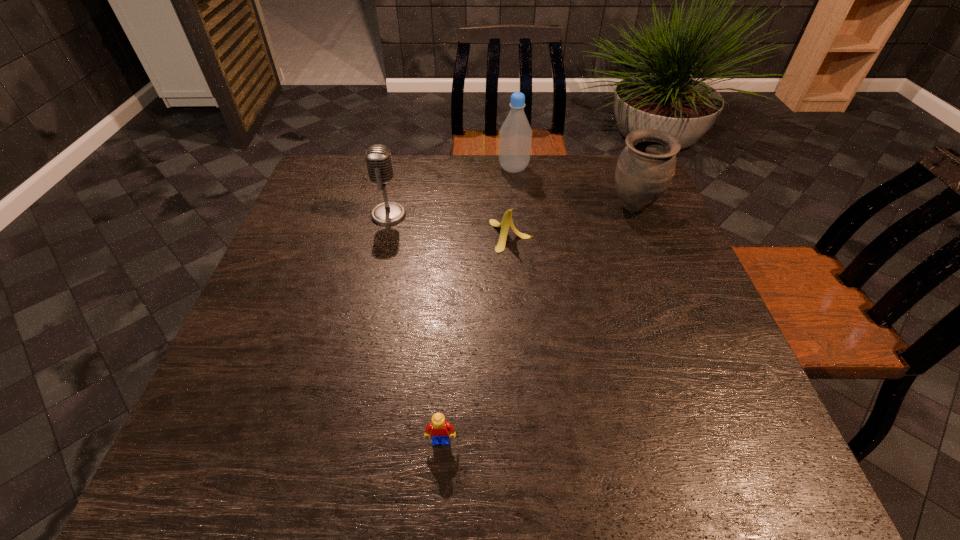
This screenshot has height=540, width=960. In order to click on object that is the fourth closest one to the rightmost object in this screenshot , I will do `click(439, 428)`.

Identify which object is the third nearest to the urn. Please provide its 2D coordinates. Your answer should be formatted as a tuple, i.e. [(x, y)], where the tuple contains the x and y coordinates of a point satisfying the conditions above.

[(378, 157)]

The height and width of the screenshot is (540, 960). In order to click on free spot that satisfies the following two spatial constraints: 1. on the back side of the banana; 2. on the right side of the urn in this screenshot , I will do `click(509, 207)`.